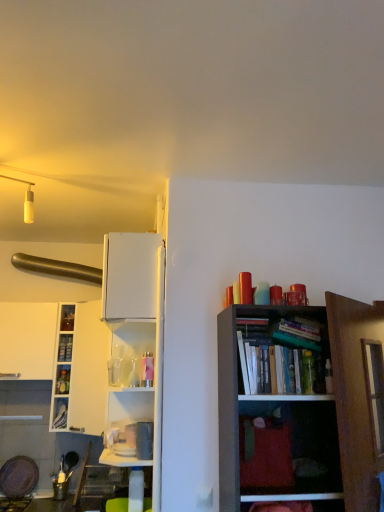
Question: Does hardcover book at upper right, marked as the 2th book in a bottom-to-top arrangement, have a lesser height compared to white glossy cabinet at left?

Choices:
 (A) yes
 (B) no

Answer: (A)

Question: From a real-world perspective, is hardcover book at upper right, marked as the 2th book in a bottom-to-top arrangement, positioned under white glossy cabinet at left based on gravity?

Choices:
 (A) no
 (B) yes

Answer: (B)

Question: Is hardcover book at upper right, marked as the 2th book in a bottom-to-top arrangement, positioned with its back to white glossy cabinet at left?

Choices:
 (A) no
 (B) yes

Answer: (A)

Question: Is hardcover book at upper right, which is the second book in back-to-front order, smaller than white glossy cabinet at left?

Choices:
 (A) no
 (B) yes

Answer: (B)

Question: Is hardcover book at upper right, which is the second book in back-to-front order, next to white glossy cabinet at left and touching it?

Choices:
 (A) no
 (B) yes

Answer: (A)

Question: Choose the correct answer: Is white glossy cabinet at left inside white glossy cabinet at left, which is counted as the second cabinet, starting from the bottom, or outside it?

Choices:
 (A) outside
 (B) inside

Answer: (A)

Question: In the image, is white glossy cabinet at left on the left side or the right side of white glossy cabinet at left, the 1th cabinet when ordered from top to bottom?

Choices:
 (A) right
 (B) left

Answer: (A)

Question: Is white glossy cabinet at left in front of or behind white glossy cabinet at left, the 1th cabinet when ordered from top to bottom, in the image?

Choices:
 (A) front
 (B) behind

Answer: (A)

Question: Considering the positions of point (92, 415) and point (64, 369), is point (92, 415) closer or farther from the camera than point (64, 369)?

Choices:
 (A) closer
 (B) farther

Answer: (A)

Question: Considering the positions of hardcover book at upper right, which is counted as the 1th book, starting from the right, and brushed metal exhaust hood at upper left in the image, is hardcover book at upper right, which is counted as the 1th book, starting from the right, wider or thinner than brushed metal exhaust hood at upper left?

Choices:
 (A) thin
 (B) wide

Answer: (A)

Question: Considering their positions, is hardcover book at upper right, marked as the 2th book in a bottom-to-top arrangement, located in front of or behind brushed metal exhaust hood at upper left?

Choices:
 (A) behind
 (B) front

Answer: (B)

Question: Considering the positions of point pyautogui.click(x=283, y=373) and point pyautogui.click(x=14, y=252), is point pyautogui.click(x=283, y=373) closer or farther from the camera than point pyautogui.click(x=14, y=252)?

Choices:
 (A) closer
 (B) farther

Answer: (A)

Question: Based on their sizes in the image, would you say hardcover book at upper right, which is the second book in back-to-front order, is bigger or smaller than brushed metal exhaust hood at upper left?

Choices:
 (A) small
 (B) big

Answer: (A)

Question: Considering the positions of white glossy cabinet at left, the 1th cabinet when ordered from top to bottom, and hardcover book at upper right, the 2th book when ordered from left to right, in the image, is white glossy cabinet at left, the 1th cabinet when ordered from top to bottom, wider or thinner than hardcover book at upper right, the 2th book when ordered from left to right,?

Choices:
 (A) thin
 (B) wide

Answer: (B)

Question: Is white glossy cabinet at left, the 1th cabinet when ordered from top to bottom, taller or shorter than hardcover book at upper right, which is the second book in back-to-front order?

Choices:
 (A) short
 (B) tall

Answer: (B)